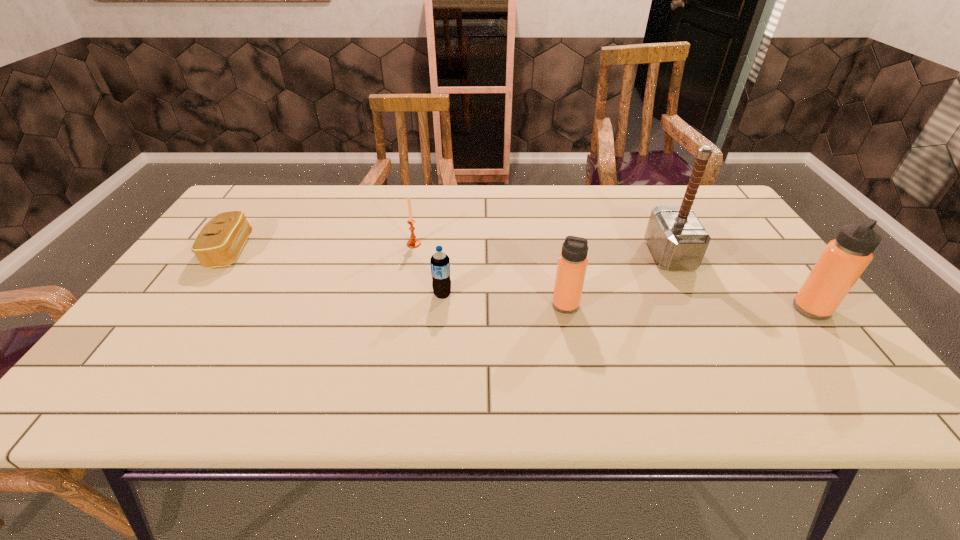
Find the location of a particular element. This screenshot has width=960, height=540. vacant space situated 0.300m on the back of the fourth object from left to right is located at coordinates (549, 227).

Image resolution: width=960 pixels, height=540 pixels. I want to click on vacant space located 0.150m on the back of the rightmost object, so click(772, 259).

Identify the location of vacant space located on the left of the candle_holder. The image size is (960, 540). (372, 244).

Where is `free space located on the front of the hammer`? The width and height of the screenshot is (960, 540). free space located on the front of the hammer is located at coordinates (715, 343).

Find the location of a particular element. vacant point located 0.300m on the zipper side of the leftmost object is located at coordinates (356, 251).

Locate an element on the screen. This screenshot has height=540, width=960. free space located on the front of the soda bottle is located at coordinates (439, 332).

This screenshot has height=540, width=960. In order to click on object located at the left edge in this screenshot , I will do `click(218, 244)`.

This screenshot has height=540, width=960. Find the location of `object situated at the right edge`. object situated at the right edge is located at coordinates (845, 258).

Find the location of a particular element. This screenshot has width=960, height=540. vacant space at the far edge is located at coordinates (498, 203).

Image resolution: width=960 pixels, height=540 pixels. Identify the location of free space at the near edge. (228, 339).